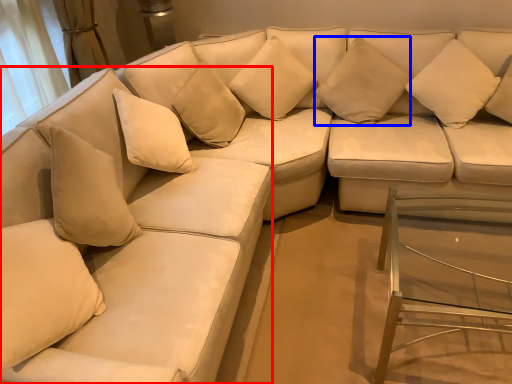
Question: Which object is closer to the camera taking this photo, couch (highlighted by a red box) or pillow (highlighted by a blue box)?

Choices:
 (A) couch
 (B) pillow

Answer: (A)